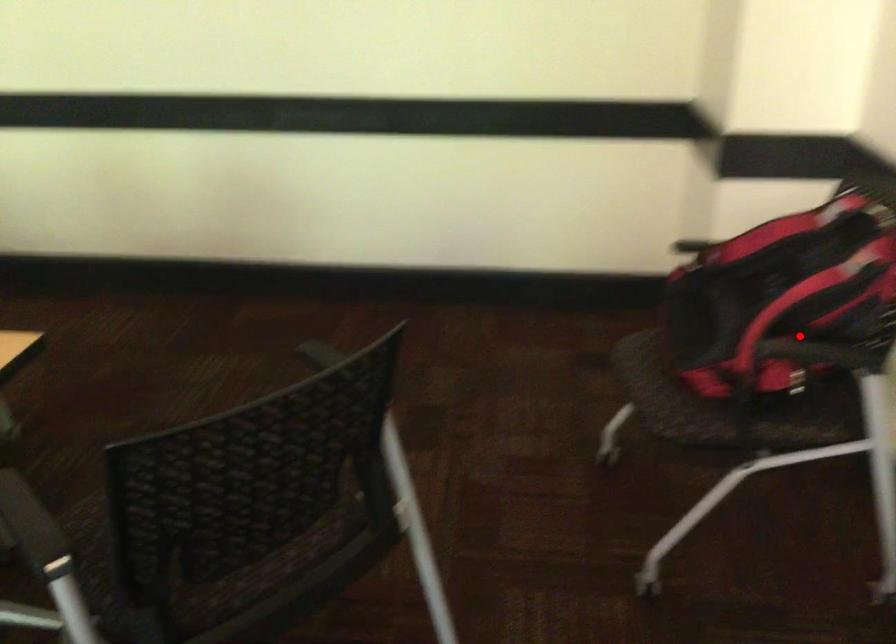
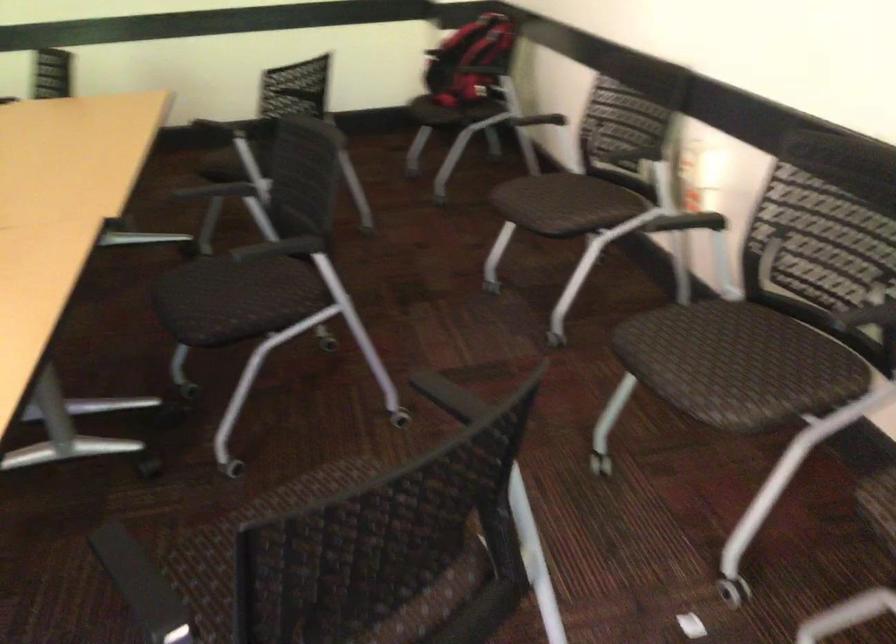
Question: I am providing you with two images of the same scene from different viewpoints. Image1 has a red point marked. In image2, the corresponding 3D location appears at what relative position? Reply with the corresponding letter.

Choices:
 (A) Closer
 (B) Farther

Answer: (B)